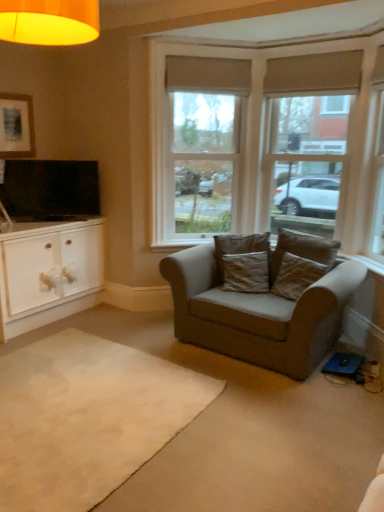
Where is `beige carpet at lower center`? Image resolution: width=384 pixels, height=512 pixels. beige carpet at lower center is located at coordinates (87, 418).

Image resolution: width=384 pixels, height=512 pixels. What do you see at coordinates (196, 145) in the screenshot?
I see `white wood window at center, the second window when ordered from right to left` at bounding box center [196, 145].

The width and height of the screenshot is (384, 512). What do you see at coordinates (308, 136) in the screenshot? I see `clear glass window at upper right, positioned as the 2th window in left-to-right order` at bounding box center [308, 136].

What do you see at coordinates (296, 276) in the screenshot?
I see `brown suede pillow at center, which appears as the second pillow when viewed from the left` at bounding box center [296, 276].

Where is `flat screen tv at left`? This screenshot has height=512, width=384. flat screen tv at left is located at coordinates (50, 190).

Image resolution: width=384 pixels, height=512 pixels. What do you see at coordinates (302, 250) in the screenshot?
I see `brown suede pillow at center, positioned as the first pillow in right-to-left order` at bounding box center [302, 250].

The height and width of the screenshot is (512, 384). Identify the location of beige carpet at lower center. (87, 418).

From the image's perspective, relative to flat screen tv at left, is brown fabric pillow at center, the first pillow positioned from the left, above or below?

brown fabric pillow at center, the first pillow positioned from the left, is below flat screen tv at left.

Which is more to the right, brown fabric pillow at center, the first pillow positioned from the left, or flat screen tv at left?

From the viewer's perspective, brown fabric pillow at center, the first pillow positioned from the left, appears more on the right side.

Measure the distance between brown fabric pillow at center, placed as the third pillow when sorted from right to left, and flat screen tv at left.

The distance of brown fabric pillow at center, placed as the third pillow when sorted from right to left, from flat screen tv at left is 1.62 meters.

Do you think brown fabric pillow at center, placed as the third pillow when sorted from right to left, is within flat screen tv at left, or outside of it?

brown fabric pillow at center, placed as the third pillow when sorted from right to left, lies outside flat screen tv at left.

Starting from the white wood cabinet at left, which window is the 1st one to the right? Please provide its 2D coordinates.

[(196, 145)]

Would you say white wood window at center, the first window positioned from the left, is to the left or to the right of white wood cabinet at left in the picture?

Based on their positions, white wood window at center, the first window positioned from the left, is located to the right of white wood cabinet at left.

From a real-world perspective, is white wood window at center, the first window positioned from the left, located beneath white wood cabinet at left?

Incorrect, from a real-world perspective, white wood window at center, the first window positioned from the left, is higher than white wood cabinet at left.

How far apart are white wood window at center, the second window when ordered from right to left, and white wood cabinet at left?

white wood window at center, the second window when ordered from right to left, and white wood cabinet at left are 3.91 feet apart from each other.

Can you tell me how much clear glass window at upper right, which is the first window from right to left, and suede gray couch at center differ in facing direction?

The angle between the facing direction of clear glass window at upper right, which is the first window from right to left, and the facing direction of suede gray couch at center is 1.31 degrees.

From a real-world perspective, who is located higher, clear glass window at upper right, positioned as the 2th window in left-to-right order, or suede gray couch at center?

clear glass window at upper right, positioned as the 2th window in left-to-right order.

Is there a large distance between clear glass window at upper right, which is the first window from right to left, and suede gray couch at center?

Indeed, clear glass window at upper right, which is the first window from right to left, is not near suede gray couch at center.

In terms of height, does clear glass window at upper right, positioned as the 2th window in left-to-right order, look taller or shorter compared to suede gray couch at center?

In the image, clear glass window at upper right, positioned as the 2th window in left-to-right order, appears to be taller than suede gray couch at center.

Which of these two, brown suede pillow at center, arranged as the 2th pillow when viewed from the right, or brown suede pillow at center, positioned as the first pillow in right-to-left order, is thinner?

brown suede pillow at center, positioned as the first pillow in right-to-left order, is thinner.

Would you say brown suede pillow at center, which appears as the second pillow when viewed from the left, is a long distance from brown suede pillow at center, placed as the 3th pillow when sorted from left to right?

No, brown suede pillow at center, which appears as the second pillow when viewed from the left, is in close proximity to brown suede pillow at center, placed as the 3th pillow when sorted from left to right.

Where is `pillow located in front of the brown suede pillow at center, positioned as the first pillow in right-to-left order`? pillow located in front of the brown suede pillow at center, positioned as the first pillow in right-to-left order is located at coordinates (296, 276).

From a real-world perspective, is brown suede pillow at center, which appears as the second pillow when viewed from the left, on brown suede pillow at center, positioned as the first pillow in right-to-left order?

No, from a real-world perspective, brown suede pillow at center, which appears as the second pillow when viewed from the left, is not over brown suede pillow at center, positioned as the first pillow in right-to-left order

Measure the distance between matte black picture frame at upper left and beige carpet at lower center.

matte black picture frame at upper left is 2.51 meters from beige carpet at lower center.

From the image's perspective, is matte black picture frame at upper left above or below beige carpet at lower center?

matte black picture frame at upper left is above beige carpet at lower center.

Would you say matte black picture frame at upper left is to the left or to the right of beige carpet at lower center in the picture?

Based on their positions, matte black picture frame at upper left is located to the left of beige carpet at lower center.

Is matte black picture frame at upper left facing away from beige carpet at lower center?

No, matte black picture frame at upper left is not facing the opposite direction of beige carpet at lower center.

Who is bigger, beige carpet at lower center or white wood window at center, the first window positioned from the left?

white wood window at center, the first window positioned from the left, is bigger.

From a real-world perspective, between beige carpet at lower center and white wood window at center, the first window positioned from the left, who is vertically lower?

beige carpet at lower center, from a real-world perspective.

Which object is closer to the camera, beige carpet at lower center or white wood window at center, the first window positioned from the left?

beige carpet at lower center is closer to the camera.

Does beige carpet at lower center touch white wood window at center, the first window positioned from the left?

There is a gap between beige carpet at lower center and white wood window at center, the first window positioned from the left.

Based on the photo, is brown suede pillow at center, which appears as the second pillow when viewed from the left, looking in the opposite direction of beige carpet at lower center?

That's not correct — brown suede pillow at center, which appears as the second pillow when viewed from the left, is not looking away from beige carpet at lower center.

Which object is thinner, brown suede pillow at center, which appears as the second pillow when viewed from the left, or beige carpet at lower center?

brown suede pillow at center, which appears as the second pillow when viewed from the left.

Can you tell me how much brown suede pillow at center, which appears as the second pillow when viewed from the left, and beige carpet at lower center differ in facing direction?

15.5 degrees separate the facing orientations of brown suede pillow at center, which appears as the second pillow when viewed from the left, and beige carpet at lower center.

Find the location of a particular element. television located on the left of brown fabric pillow at center, the first pillow positioned from the left is located at coordinates (50, 190).

Find the location of a particular element. Image resolution: width=384 pixels, height=512 pixels. cabinetry below the white wood window at center, the second window when ordered from right to left (from a real-world perspective) is located at coordinates (48, 272).

Considering their positions, is white wood cabinet at left positioned closer to white wood window at center, the second window when ordered from right to left, than brown suede pillow at center, which appears as the second pillow when viewed from the left?

white wood cabinet at left is positioned closer to the anchor white wood window at center, the second window when ordered from right to left.

From the image, which object appears to be nearer to brown suede pillow at center, positioned as the first pillow in right-to-left order, suede gray couch at center or clear glass window at upper right, which is the first window from right to left?

Among the two, suede gray couch at center is located nearer to brown suede pillow at center, positioned as the first pillow in right-to-left order.

Consider the image. Which object lies nearer to the anchor point brown fabric pillow at center, placed as the third pillow when sorted from right to left, matte black picture frame at upper left or flat screen tv at left?

flat screen tv at left lies closer to brown fabric pillow at center, placed as the third pillow when sorted from right to left, than the other object.

Looking at the image, which one is located closer to flat screen tv at left, matte black picture frame at upper left or white wood window at center, the first window positioned from the left?

matte black picture frame at upper left is positioned closer to the anchor flat screen tv at left.

Looking at this image, estimate the real-world distances between objects in this image. Which object is closer to brown suede pillow at center, arranged as the 2th pillow when viewed from the right, brown suede pillow at center, placed as the 3th pillow when sorted from left to right, or suede gray couch at center?

Among the two, brown suede pillow at center, placed as the 3th pillow when sorted from left to right, is located nearer to brown suede pillow at center, arranged as the 2th pillow when viewed from the right.

Looking at the image, which one is located closer to flat screen tv at left, brown fabric pillow at center, the first pillow positioned from the left, or matte black picture frame at upper left?

matte black picture frame at upper left lies closer to flat screen tv at left than the other object.

Based on their spatial positions, is white wood window at center, the first window positioned from the left, or clear glass window at upper right, positioned as the 2th window in left-to-right order, further from brown suede pillow at center, which appears as the second pillow when viewed from the left?

Based on the image, white wood window at center, the first window positioned from the left, appears to be further to brown suede pillow at center, which appears as the second pillow when viewed from the left.

From the image, which object appears to be farther from brown suede pillow at center, which appears as the second pillow when viewed from the left, white wood window at center, the first window positioned from the left, or brown fabric pillow at center, the first pillow positioned from the left?

white wood window at center, the first window positioned from the left, is further to brown suede pillow at center, which appears as the second pillow when viewed from the left.

At what (x,y) coordinates should I click in order to perform the action: click on cabinetry between matte black picture frame at upper left and beige carpet at lower center in the vertical direction. Please return your answer as a coordinate pair (x, y). The image size is (384, 512). Looking at the image, I should click on (48, 272).

Where is `cabinetry between matte black picture frame at upper left and brown fabric pillow at center, placed as the third pillow when sorted from right to left`? The width and height of the screenshot is (384, 512). cabinetry between matte black picture frame at upper left and brown fabric pillow at center, placed as the third pillow when sorted from right to left is located at coordinates (48, 272).

Where is `studio couch located between beige carpet at lower center and brown suede pillow at center, positioned as the first pillow in right-to-left order, in the left-right direction`? This screenshot has height=512, width=384. studio couch located between beige carpet at lower center and brown suede pillow at center, positioned as the first pillow in right-to-left order, in the left-right direction is located at coordinates (262, 306).

The image size is (384, 512). What are the coordinates of `pillow between white wood cabinet at left and brown suede pillow at center, arranged as the 2th pillow when viewed from the right, from left to right` in the screenshot? It's located at click(238, 246).